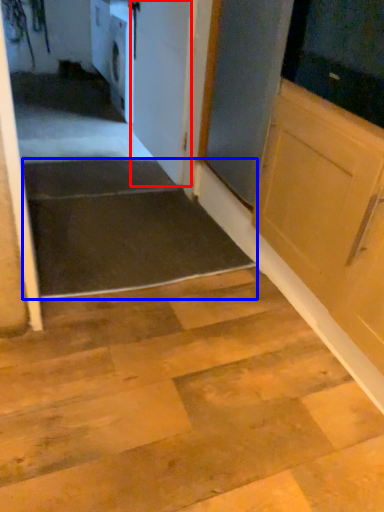
Question: Which object appears farthest to the camera in this image, door (highlighted by a red box) or stairwell (highlighted by a blue box)?

Choices:
 (A) door
 (B) stairwell

Answer: (A)